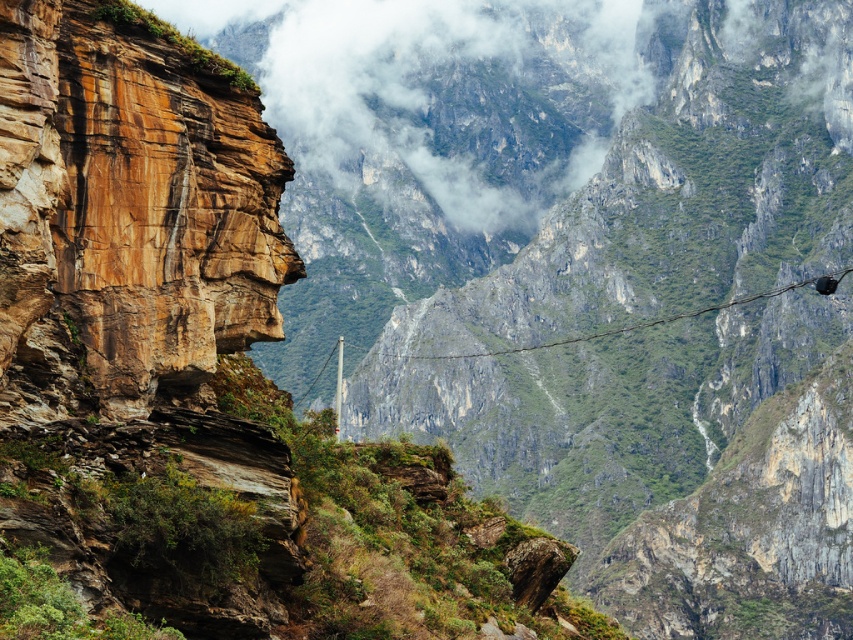
Does rustic stone face at upper left have a lesser height compared to white fluffy cloud at upper center?

Yes.

The image size is (853, 640). What do you see at coordinates (129, 209) in the screenshot?
I see `rustic stone face at upper left` at bounding box center [129, 209].

Locate an element on the screen. This screenshot has width=853, height=640. rustic stone face at upper left is located at coordinates (129, 209).

Does point (463, 81) come closer to viewer compared to point (641, 328)?

No, it is behind (641, 328).

Who is shorter, white fluffy cloud at upper center or rustic wire at center?

Standing shorter between the two is rustic wire at center.

The width and height of the screenshot is (853, 640). In order to click on white fluffy cloud at upper center in this screenshot , I will do `click(437, 92)`.

Is rustic stone face at upper left shorter than rustic wire at center?

No, rustic stone face at upper left is not shorter than rustic wire at center.

Who is shorter, rustic stone face at upper left or rustic wire at center?

Standing shorter between the two is rustic wire at center.

Locate an element on the screen. Image resolution: width=853 pixels, height=640 pixels. rustic stone face at upper left is located at coordinates (129, 209).